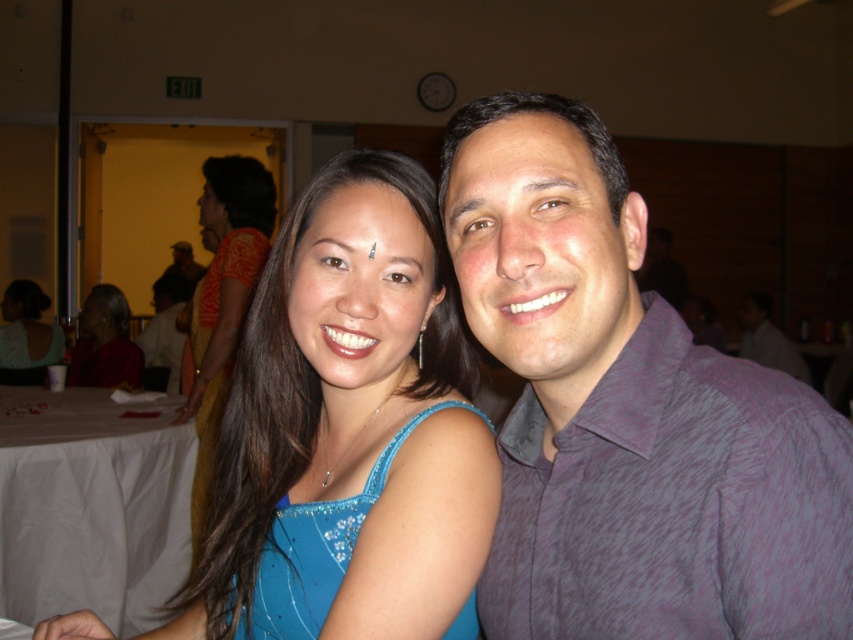
Question: Which object is positioned closest to the blue sequined dress at center?

Choices:
 (A) white cloth at lower left
 (B) matte red blouse at lower left
 (C) blue silk saree at center

Answer: (C)

Question: Where is blue sequined dress at center located in relation to matte red blouse at lower left in the image?

Choices:
 (A) left
 (B) right

Answer: (B)

Question: Which object appears closest to the camera in this image?

Choices:
 (A) purple textured shirt at right
 (B) white cloth at lower left
 (C) blue silk saree at center
 (D) matte red blouse at lower left

Answer: (A)

Question: Which object is closer to the camera taking this photo?

Choices:
 (A) matte red blouse at lower left
 (B) purple textured shirt at right

Answer: (B)

Question: Can you confirm if blue silk saree at center is positioned to the right of matte green blouse at center?

Choices:
 (A) yes
 (B) no

Answer: (A)

Question: Where is purple textured shirt at right located in relation to white cloth at lower left in the image?

Choices:
 (A) below
 (B) above

Answer: (B)